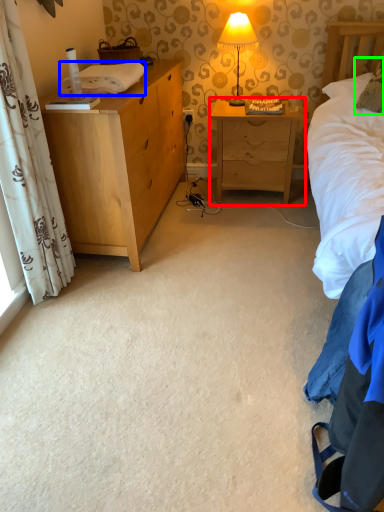
Question: Based on their relative distances, which object is farther from nightstand (highlighted by a red box)? Choose from cloth (highlighted by a blue box) and pillow (highlighted by a green box).

Choices:
 (A) cloth
 (B) pillow

Answer: (A)